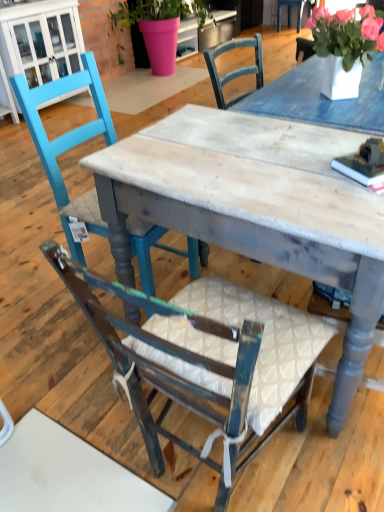
Question: Does teal painted wood chair at left, the 2th chair when ordered from front to back, have a greater height compared to white ceramic vase at upper right?

Choices:
 (A) yes
 (B) no

Answer: (A)

Question: Is the surface of teal painted wood chair at left, marked as the 1th chair in a back-to-front arrangement, in direct contact with white ceramic vase at upper right?

Choices:
 (A) no
 (B) yes

Answer: (A)

Question: Is teal painted wood chair at left, marked as the 1th chair in a back-to-front arrangement, looking in the opposite direction of white ceramic vase at upper right?

Choices:
 (A) no
 (B) yes

Answer: (A)

Question: Is teal painted wood chair at left, marked as the 1th chair in a back-to-front arrangement, far away from white ceramic vase at upper right?

Choices:
 (A) no
 (B) yes

Answer: (A)

Question: Is teal painted wood chair at left, the 2th chair when ordered from front to back, at the right side of white ceramic vase at upper right?

Choices:
 (A) no
 (B) yes

Answer: (A)

Question: Looking at their shapes, would you say white ceramic vase at upper right is wider or thinner than pink matte pot at upper center?

Choices:
 (A) thin
 (B) wide

Answer: (A)

Question: Relative to pink matte pot at upper center, is white ceramic vase at upper right in front or behind?

Choices:
 (A) front
 (B) behind

Answer: (A)

Question: Choose the correct answer: Is white ceramic vase at upper right inside pink matte pot at upper center or outside it?

Choices:
 (A) inside
 (B) outside

Answer: (B)

Question: Is white ceramic vase at upper right to the left or to the right of pink matte pot at upper center in the image?

Choices:
 (A) left
 (B) right

Answer: (B)

Question: From the image's perspective, is white ceramic vase at upper right located above or below distressed wood table at center?

Choices:
 (A) above
 (B) below

Answer: (A)

Question: Considering their positions, is white ceramic vase at upper right located in front of or behind distressed wood table at center?

Choices:
 (A) behind
 (B) front

Answer: (A)

Question: Is point (340, 69) closer or farther from the camera than point (249, 182)?

Choices:
 (A) farther
 (B) closer

Answer: (A)

Question: Is white ceramic vase at upper right taller or shorter than distressed wood table at center?

Choices:
 (A) short
 (B) tall

Answer: (A)

Question: Considering their positions, is wooden chair with white cushion at center, the 1th chair when ordered from front to back, located in front of or behind pink matte pot at upper center?

Choices:
 (A) front
 (B) behind

Answer: (A)

Question: Which is correct: wooden chair with white cushion at center, which is the 2th chair from back to front, is inside pink matte pot at upper center, or outside of it?

Choices:
 (A) inside
 (B) outside

Answer: (B)